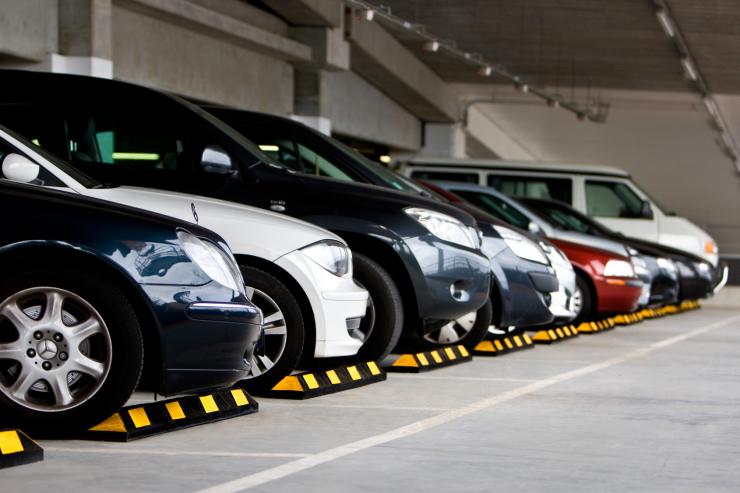
Identify the location of windows. (154, 137), (13, 155), (289, 146), (462, 171), (534, 182), (622, 191), (502, 209), (571, 211), (417, 183).